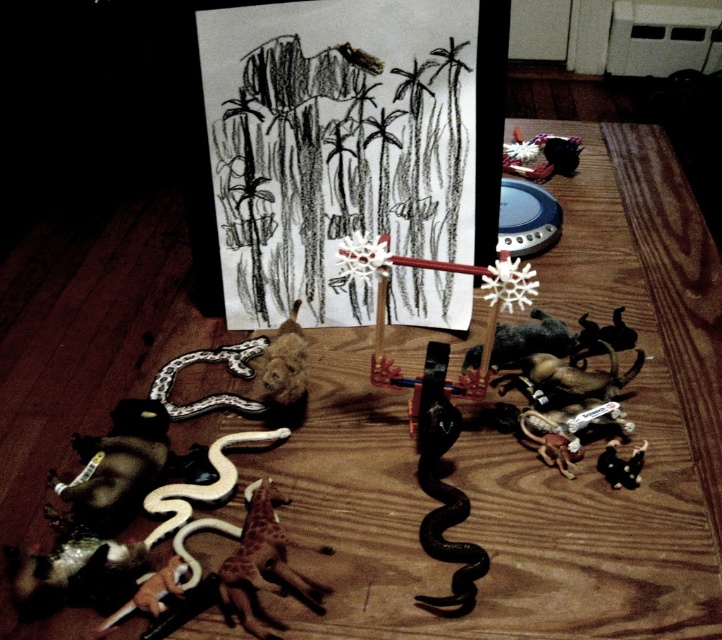
You are a child looking at the jungle drawing on the wooden floor. You want to place your new toy snake exactly where the black rubber snake at center is located. Where should you place your toy snake?

You should place your toy snake at the 2D location point (445,508) where the black rubber snake at center is located.

You are a child playing with the black rubber snake at center and the speckled plastic snake at lower left. Which snake can you stack on top of the other without it falling over?

The black rubber snake at center is taller than the speckled plastic snake at lower left, so you can stack the speckled plastic snake at lower left on top of the black rubber snake at center without it falling over.